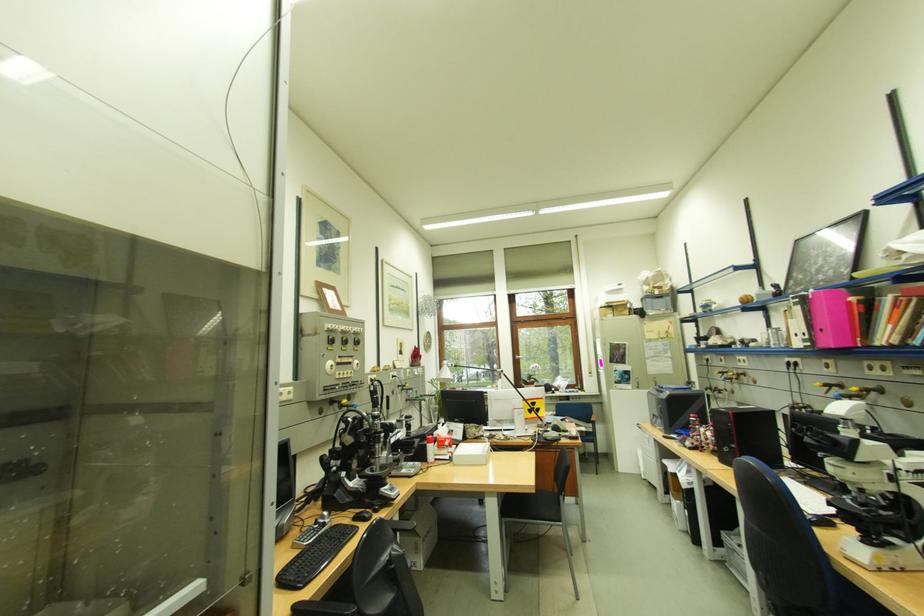
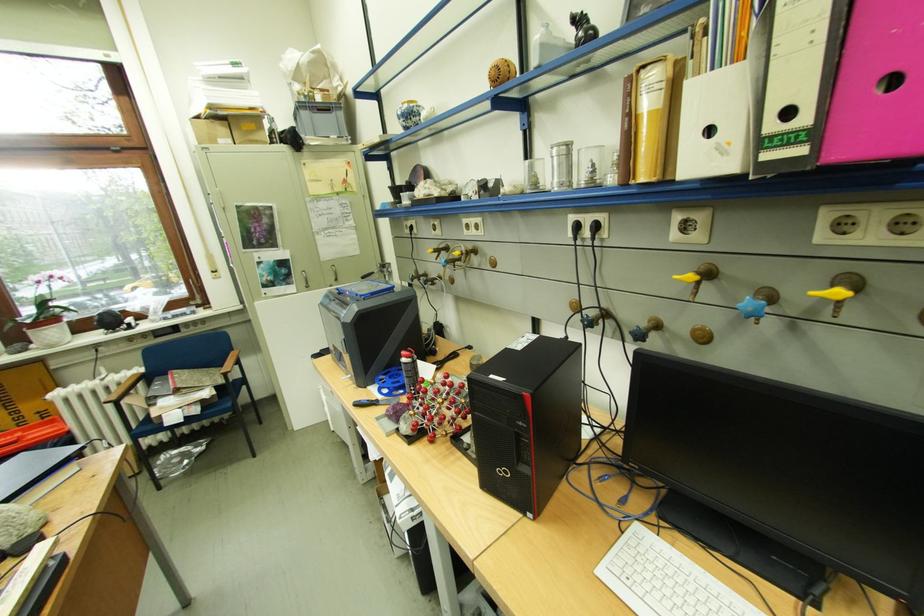
Where in the second image is the point corresponding to point (700, 422) from the first image?

(412, 366)